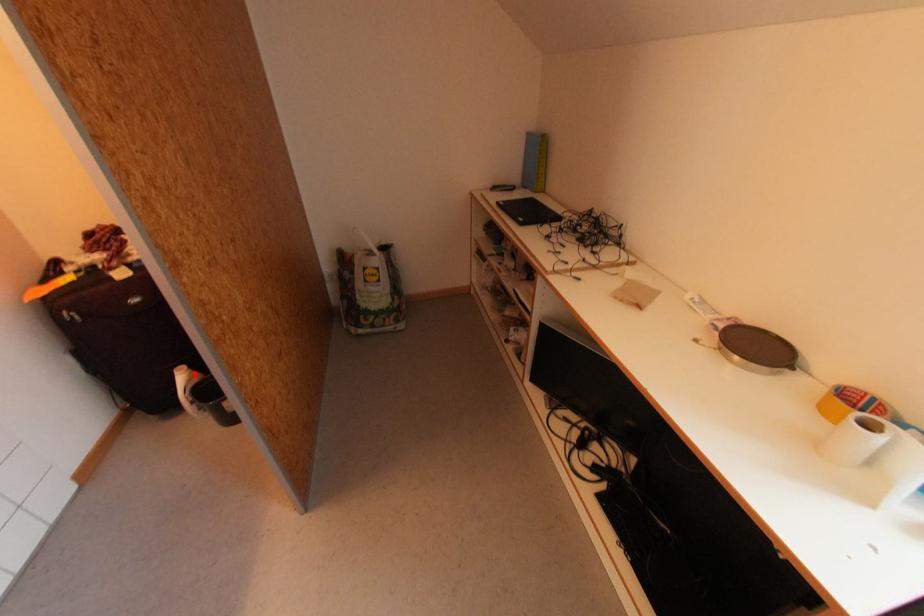
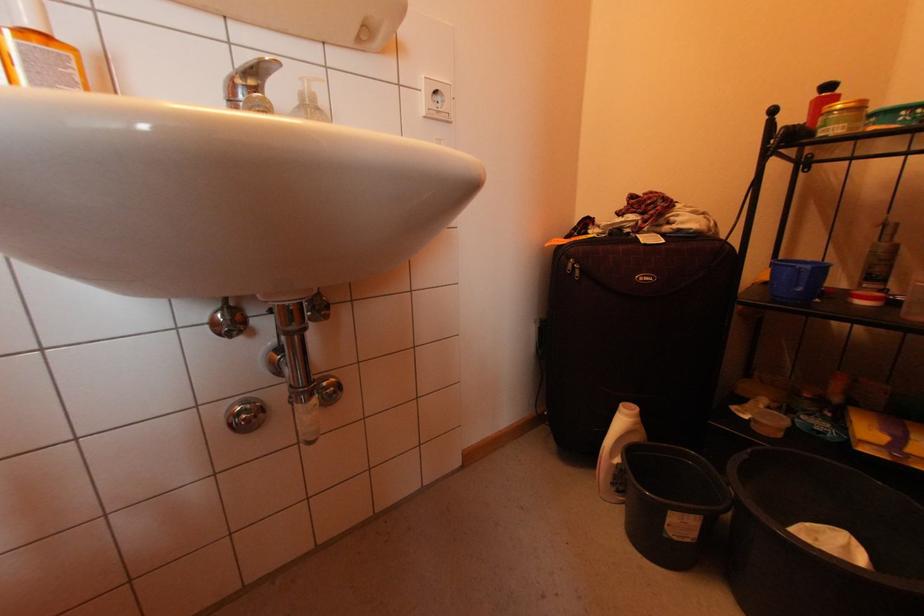
The point at the highlighted location is marked in the first image. Where is the corresponding point in the second image?

(640, 424)